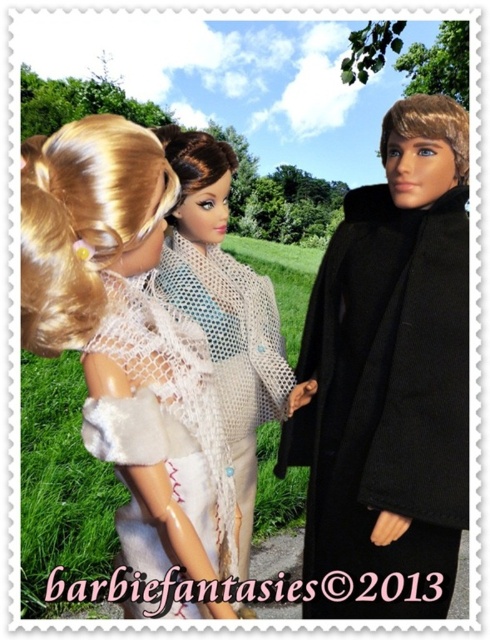
Question: Which object is positioned farthest from the white fuzzy coat at upper left?

Choices:
 (A) white lace scarf at center
 (B) black wool coat at right

Answer: (B)

Question: Observing the image, what is the correct spatial positioning of white fuzzy coat at upper left in reference to white lace scarf at center?

Choices:
 (A) below
 (B) above

Answer: (B)

Question: Which point is closer to the camera?

Choices:
 (A) white fuzzy coat at upper left
 (B) black wool coat at right
 (C) white lace scarf at center

Answer: (A)

Question: Among these objects, which one is farthest from the camera?

Choices:
 (A) white lace scarf at center
 (B) white fuzzy coat at upper left
 (C) black wool coat at right

Answer: (A)

Question: Can you confirm if black wool coat at right is wider than white fuzzy coat at upper left?

Choices:
 (A) yes
 (B) no

Answer: (A)

Question: Is black wool coat at right positioned at the back of white fuzzy coat at upper left?

Choices:
 (A) yes
 (B) no

Answer: (A)